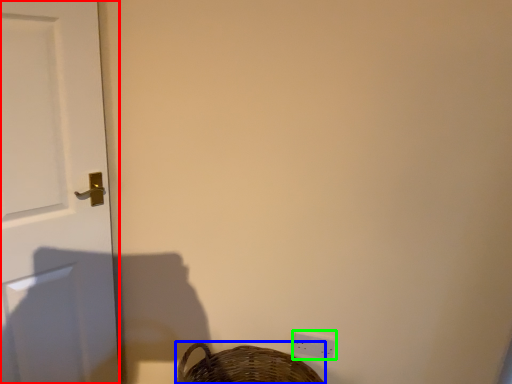
Question: Which is farther away from door (highlighted by a red box)? basket (highlighted by a blue box) or light switch (highlighted by a green box)?

Choices:
 (A) basket
 (B) light switch

Answer: (B)